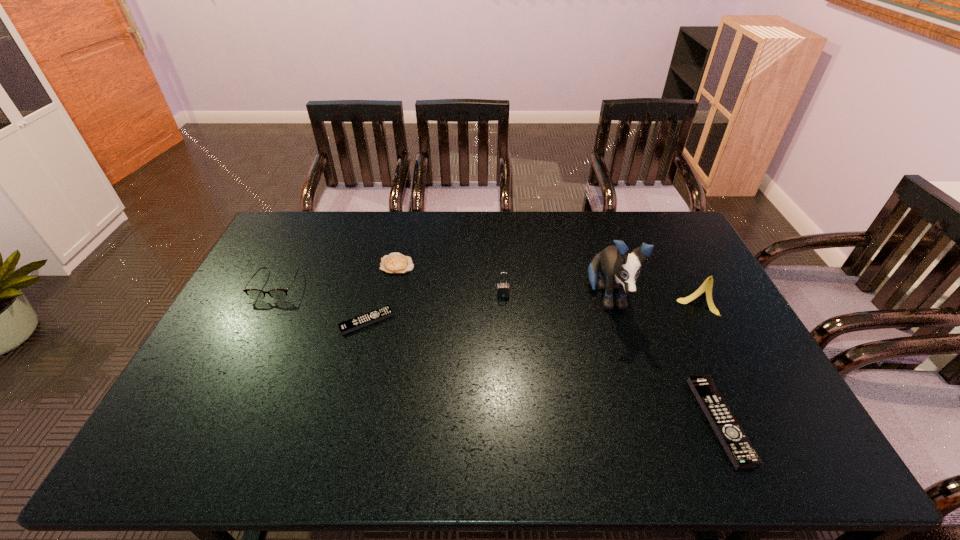
Identify the location of the fourth shortest object. (255, 294).

Where is `banana`? The width and height of the screenshot is (960, 540). banana is located at coordinates (707, 285).

Identify the location of vacant space positioned on the left of the left remote control. Image resolution: width=960 pixels, height=540 pixels. (307, 321).

This screenshot has height=540, width=960. Find the location of `vacant point located on the left of the nearer remote control`. vacant point located on the left of the nearer remote control is located at coordinates (585, 421).

Image resolution: width=960 pixels, height=540 pixels. Find the location of `vacant space situated 0.090m on the front-facing side of the tallest object`. vacant space situated 0.090m on the front-facing side of the tallest object is located at coordinates (624, 354).

This screenshot has width=960, height=540. In order to click on free space located on the shackle of the padlock in this screenshot , I will do `click(507, 359)`.

Locate an element on the screen. Image resolution: width=960 pixels, height=540 pixels. free point located on the back of the quiche is located at coordinates (404, 231).

The image size is (960, 540). Identify the location of vacant space located on the face of the leftmost object. (214, 411).

I want to click on free region located 0.190m on the front of the sixth shortest object, so click(x=732, y=368).

At what (x,y) coordinates should I click in order to perform the action: click on object at the near edge. Please return your answer as a coordinate pair (x, y). Looking at the image, I should click on (x=739, y=449).